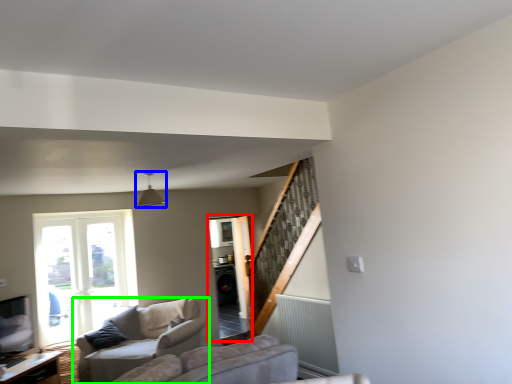
Question: Based on their relative distances, which object is nearer to screen door (highlighted by a red box)? Choose from light fixture (highlighted by a blue box) and studio couch (highlighted by a green box).

Choices:
 (A) light fixture
 (B) studio couch

Answer: (B)